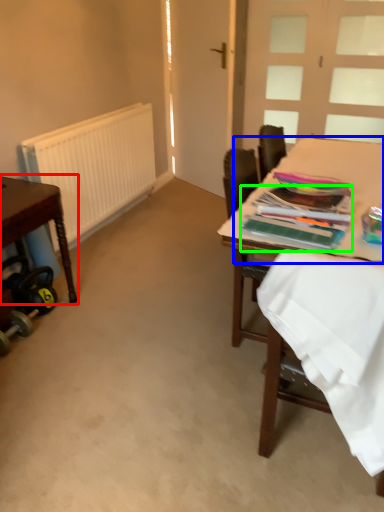
Question: Which object is positioned farthest from table (highlighted by a red box)? Select from table top (highlighted by a blue box) and magazine (highlighted by a green box).

Choices:
 (A) table top
 (B) magazine

Answer: (A)